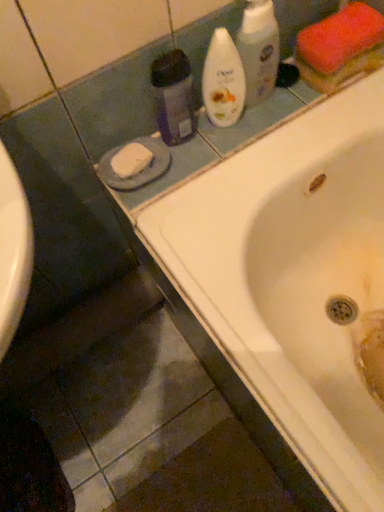
You are a GUI agent. You are given a task and a screenshot of the screen. Output one action in this format:
    pyautogui.click(x=<x>, y=<y>)
    Task: Click on the vacant area in front of white glossy bottle at upper center, which ranks as the third cleaning product in left-to-right order
    Image resolution: width=384 pixels, height=512 pixels.
    Given the screenshot: What is the action you would take?
    pyautogui.click(x=249, y=135)